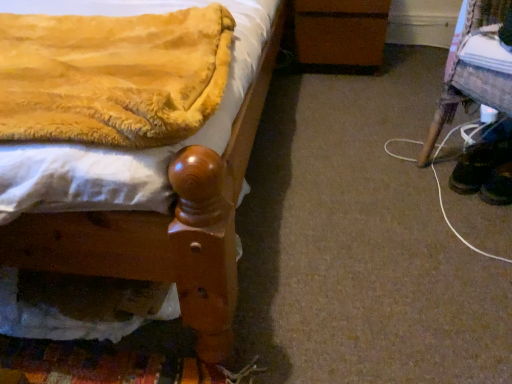
Find the location of `space that is in front of black leather shoes at lower right, which ranks as the first footwear in left-to-right order`. space that is in front of black leather shoes at lower right, which ranks as the first footwear in left-to-right order is located at coordinates (473, 222).